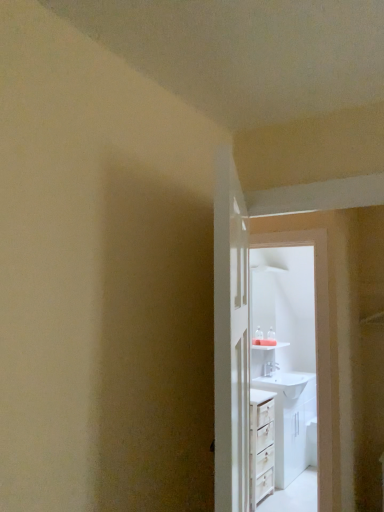
Question: Could you tell me if white glossy door at center is turned towards white glossy sink at center?

Choices:
 (A) yes
 (B) no

Answer: (B)

Question: From a real-world perspective, is white glossy door at center over white glossy sink at center?

Choices:
 (A) yes
 (B) no

Answer: (A)

Question: Considering the relative sizes of white glossy door at center and white glossy sink at center in the image provided, is white glossy door at center smaller than white glossy sink at center?

Choices:
 (A) yes
 (B) no

Answer: (A)

Question: From a real-world perspective, is white glossy door at center physically below white glossy sink at center?

Choices:
 (A) yes
 (B) no

Answer: (B)

Question: Considering the relative sizes of white glossy door at center and white glossy sink at center in the image provided, is white glossy door at center shorter than white glossy sink at center?

Choices:
 (A) yes
 (B) no

Answer: (B)

Question: From the image's perspective, is white glossy door at center under white glossy sink at center?

Choices:
 (A) no
 (B) yes

Answer: (A)

Question: From a real-world perspective, is white glossy sink at center located higher than white glossy sink at upper center?

Choices:
 (A) yes
 (B) no

Answer: (B)

Question: Is white glossy sink at center taller than white glossy sink at upper center?

Choices:
 (A) no
 (B) yes

Answer: (A)

Question: Is white glossy sink at center at the left side of white glossy sink at upper center?

Choices:
 (A) yes
 (B) no

Answer: (B)

Question: Is white glossy sink at center bigger than white glossy sink at upper center?

Choices:
 (A) no
 (B) yes

Answer: (B)

Question: Is white glossy sink at center at the right side of white glossy sink at upper center?

Choices:
 (A) yes
 (B) no

Answer: (A)

Question: Is white glossy sink at center thinner than white glossy sink at upper center?

Choices:
 (A) yes
 (B) no

Answer: (B)

Question: Are white glossy sink at center and white glossy door at center beside each other?

Choices:
 (A) yes
 (B) no

Answer: (B)